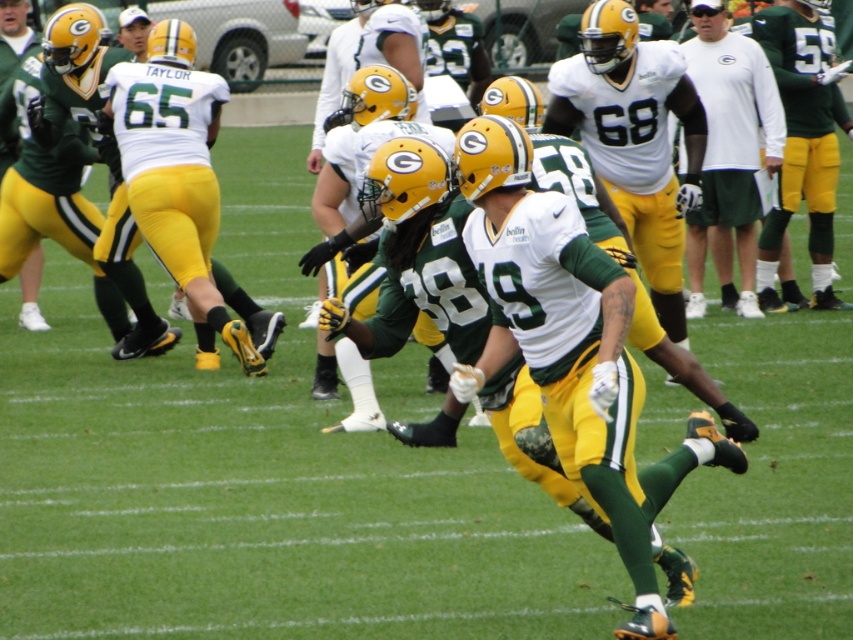
Looking at this image, you are a game analyst watching the play. The field is divided into a grid with coordinates from 0 to 1 in both x and y directions. The center of the field is at coordinate point 0.5,0.5. Where is the matte white jersey at center located in terms of coordinates?

The matte white jersey at center is located at coordinate point [634,138].

You are a referee observing the game. You notice two white items in the scene. Which one is closer to you, the matte white jersey at center or the white matte shirt at upper center?

The matte white jersey at center is closer to the viewer than the white matte shirt at upper center.